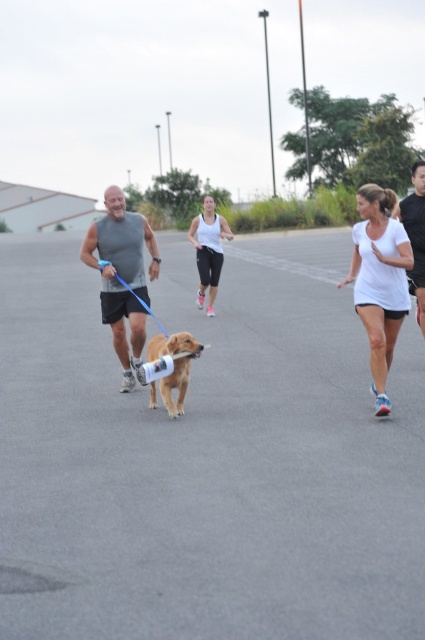
Question: Does white matte shirt at center have a smaller size compared to gray sleeveless shirt at center?

Choices:
 (A) no
 (B) yes

Answer: (B)

Question: Which object is the farthest from the gray sleeveless shirt at center?

Choices:
 (A) white matte tank top at center
 (B) matte gray tank top at center
 (C) white matte shirt at center

Answer: (A)

Question: Estimate the real-world distances between objects in this image. Which object is farther from the gray sleeveless shirt at center?

Choices:
 (A) matte gray tank top at center
 (B) golden matte dog at center
 (C) white matte tank top at center

Answer: (C)

Question: Among these points, which one is nearest to the camera?

Choices:
 (A) (356, 260)
 (B) (159, 385)

Answer: (B)

Question: Can you confirm if white matte shirt at center is bigger than gray sleeveless shirt at center?

Choices:
 (A) no
 (B) yes

Answer: (A)

Question: Does white matte shirt at center have a greater width compared to golden matte dog at center?

Choices:
 (A) no
 (B) yes

Answer: (B)